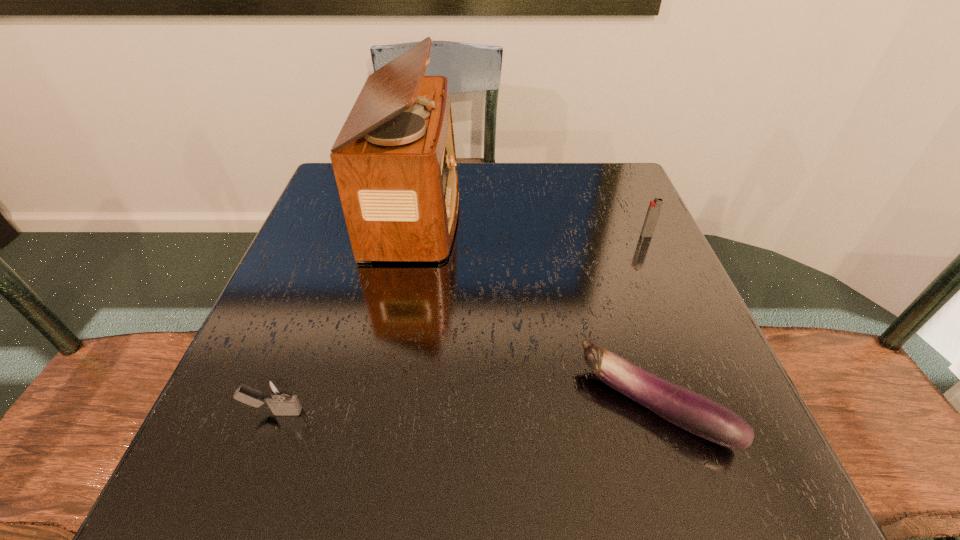
Where is `object that is at the far edge`? The height and width of the screenshot is (540, 960). object that is at the far edge is located at coordinates coord(394,161).

Image resolution: width=960 pixels, height=540 pixels. I want to click on object that is at the near edge, so click(x=694, y=412).

In order to click on radio receiver at the left edge in this screenshot , I will do `click(394, 161)`.

This screenshot has height=540, width=960. I want to click on igniter at the left edge, so click(276, 392).

You are a GUI agent. You are given a task and a screenshot of the screen. Output one action in this format:
    pyautogui.click(x=<x>, y=<y>)
    Task: Click on the igniter that is at the right edge
    The width and height of the screenshot is (960, 540).
    Given the screenshot: What is the action you would take?
    pyautogui.click(x=655, y=206)

Identify the location of eggplant that is at the right edge. This screenshot has height=540, width=960. (694, 412).

You are a GUI agent. You are given a task and a screenshot of the screen. Output one action in this format:
    pyautogui.click(x=<x>, y=<y>)
    Task: Click on the object that is at the far left corner
    This screenshot has height=540, width=960.
    Given the screenshot: What is the action you would take?
    pyautogui.click(x=394, y=161)

The height and width of the screenshot is (540, 960). Identify the location of object positioned at the near right corner. (694, 412).

At what (x,y) coordinates should I click in order to perform the action: click on vacant space at the far edge of the desktop. Please return your answer as a coordinate pair (x, y). The height and width of the screenshot is (540, 960). Looking at the image, I should click on (508, 193).

At what (x,y) coordinates should I click in order to perform the action: click on vacant space at the near edge of the desktop. Please return your answer as a coordinate pair (x, y). The width and height of the screenshot is (960, 540). Looking at the image, I should click on (625, 487).